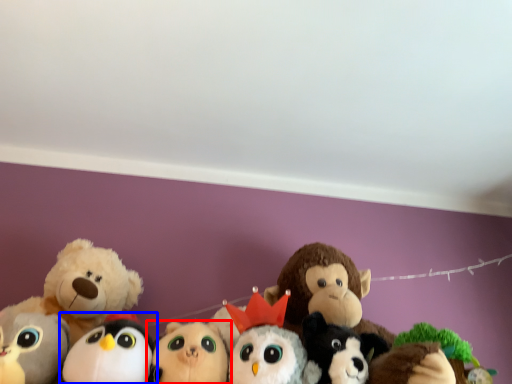
Question: Which of the following is the closest to the observer, toy (highlighted by a red box) or toy (highlighted by a blue box)?

Choices:
 (A) toy
 (B) toy

Answer: (B)